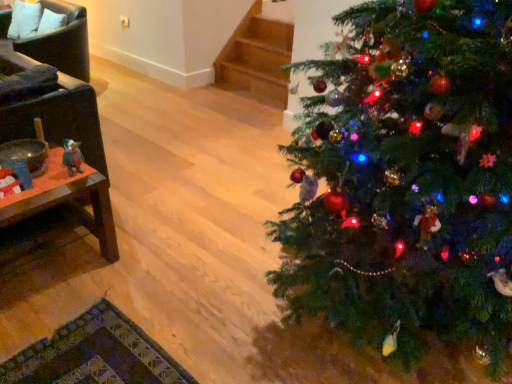
Where is `vacant area that lies to the right of woodenmaterial/texturetable at left`? vacant area that lies to the right of woodenmaterial/texturetable at left is located at coordinates (140, 273).